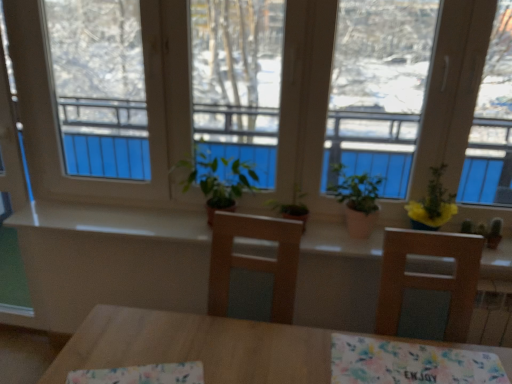
Image resolution: width=512 pixels, height=384 pixels. What do you see at coordinates (357, 200) in the screenshot? I see `green matte plant at center, the second houseplant viewed from the right` at bounding box center [357, 200].

Describe the element at coordinates (292, 207) in the screenshot. This screenshot has width=512, height=384. I see `green matte plant at center, marked as the first houseplant in a left-to-right arrangement` at that location.

The image size is (512, 384). What are the coordinates of `green matte plant at center, the third houseplant viewed from the right` in the screenshot? It's located at [292, 207].

This screenshot has width=512, height=384. In order to click on yellow matte plant at upper right, acting as the 1th houseplant starting from the right in this screenshot , I will do `click(433, 204)`.

Locate an element on the screen. This screenshot has height=384, width=512. green matte plant at center, the second houseplant viewed from the right is located at coordinates (357, 200).

In the scene shown: Is floral fabric tablecloth at lower center, which is the 1th tablecloth in right-to-left order, taller or shorter than white glossy counter top at center?

In the image, floral fabric tablecloth at lower center, which is the 1th tablecloth in right-to-left order, appears to be shorter than white glossy counter top at center.

Between floral fabric tablecloth at lower center, positioned as the 2th tablecloth in left-to-right order, and white glossy counter top at center, which one has larger size?

With larger size is white glossy counter top at center.

Considering the relative positions of floral fabric tablecloth at lower center, positioned as the 2th tablecloth in left-to-right order, and white glossy counter top at center in the image provided, is floral fabric tablecloth at lower center, positioned as the 2th tablecloth in left-to-right order, to the left of white glossy counter top at center from the viewer's perspective?

In fact, floral fabric tablecloth at lower center, positioned as the 2th tablecloth in left-to-right order, is to the right of white glossy counter top at center.

Is point (417, 370) in front of point (191, 232)?

Yes, point (417, 370) is closer to viewer.

From a real-world perspective, is yellow matte plant at upper right, which is the third houseplant in left-to-right order, positioned above or below floral fabric tablecloth at lower center, positioned as the 2th tablecloth in left-to-right order?

From a real-world perspective, yellow matte plant at upper right, which is the third houseplant in left-to-right order, is physically above floral fabric tablecloth at lower center, positioned as the 2th tablecloth in left-to-right order.

Which is correct: yellow matte plant at upper right, acting as the 1th houseplant starting from the right, is inside floral fabric tablecloth at lower center, positioned as the 2th tablecloth in left-to-right order, or outside of it?

yellow matte plant at upper right, acting as the 1th houseplant starting from the right, lies outside floral fabric tablecloth at lower center, positioned as the 2th tablecloth in left-to-right order.

Is floral fabric tablecloth at lower center, which is the 1th tablecloth in right-to-left order, at the back of yellow matte plant at upper right, which is the third houseplant in left-to-right order?

That's not correct — yellow matte plant at upper right, which is the third houseplant in left-to-right order, is not looking away from floral fabric tablecloth at lower center, which is the 1th tablecloth in right-to-left order.

Can you confirm if yellow matte plant at upper right, acting as the 1th houseplant starting from the right, is taller than floral fabric tablecloth at lower center, which is the 1th tablecloth in right-to-left order?

Indeed, yellow matte plant at upper right, acting as the 1th houseplant starting from the right, has a greater height compared to floral fabric tablecloth at lower center, which is the 1th tablecloth in right-to-left order.

Considering the relative sizes of green matte plant at center, the 2th houseplant from the left, and yellow matte plant at upper right, which is the third houseplant in left-to-right order, in the image provided, is green matte plant at center, the 2th houseplant from the left, shorter than yellow matte plant at upper right, which is the third houseplant in left-to-right order,?

Indeed, green matte plant at center, the 2th houseplant from the left, has a lesser height compared to yellow matte plant at upper right, which is the third houseplant in left-to-right order.

Can yellow matte plant at upper right, which is the third houseplant in left-to-right order, be found inside green matte plant at center, the second houseplant viewed from the right?

No.

How different are the orientations of green matte plant at center, the second houseplant viewed from the right, and yellow matte plant at upper right, acting as the 1th houseplant starting from the right, in degrees?

0.00011 degrees separate the facing orientations of green matte plant at center, the second houseplant viewed from the right, and yellow matte plant at upper right, acting as the 1th houseplant starting from the right.

From the picture: Relative to yellow matte plant at upper right, acting as the 1th houseplant starting from the right, is green matte plant at center, the 2th houseplant from the left, in front or behind?

Clearly, green matte plant at center, the 2th houseplant from the left, is behind yellow matte plant at upper right, acting as the 1th houseplant starting from the right.

Which is closer, (365, 227) or (172, 220)?

Point (365, 227) appears to be closer to the viewer than point (172, 220).

How far apart are green matte plant at center, the 2th houseplant from the left, and white glossy counter top at center?

green matte plant at center, the 2th houseplant from the left, and white glossy counter top at center are 65.92 centimeters apart from each other.

Is green matte plant at center, the second houseplant viewed from the right, bigger than white glossy counter top at center?

Incorrect, green matte plant at center, the second houseplant viewed from the right, is not larger than white glossy counter top at center.

Is point (312, 250) more distant than point (444, 370)?

Yes, it is.

Is white glossy counter top at center bigger or smaller than floral fabric tablecloth at lower center, positioned as the 2th tablecloth in left-to-right order?

In the image, white glossy counter top at center appears to be larger than floral fabric tablecloth at lower center, positioned as the 2th tablecloth in left-to-right order.

From a real-world perspective, does white glossy counter top at center stand above floral fabric tablecloth at lower center, which is the 1th tablecloth in right-to-left order?

No.

Is white glossy counter top at center looking in the opposite direction of floral fabric tablecloth at lower center, which is the 1th tablecloth in right-to-left order?

Yes, floral fabric tablecloth at lower center, which is the 1th tablecloth in right-to-left order, is at the back of white glossy counter top at center.

From a real-world perspective, is green matte plant at center, marked as the first houseplant in a left-to-right arrangement, physically located above or below white glossy counter top at center?

In terms of real-world spatial position, green matte plant at center, marked as the first houseplant in a left-to-right arrangement, is above white glossy counter top at center.

Is green matte plant at center, marked as the first houseplant in a left-to-right arrangement, to the right of white glossy counter top at center from the viewer's perspective?

Correct, you'll find green matte plant at center, marked as the first houseplant in a left-to-right arrangement, to the right of white glossy counter top at center.

Can white glossy counter top at center be found inside green matte plant at center, the third houseplant viewed from the right?

Actually, white glossy counter top at center is outside green matte plant at center, the third houseplant viewed from the right.

Is green matte plant at center, marked as the first houseplant in a left-to-right arrangement, facing towards white glossy counter top at center?

No, green matte plant at center, marked as the first houseplant in a left-to-right arrangement, is not turned towards white glossy counter top at center.

Which of these two, green matte plant at center, the second houseplant viewed from the right, or green matte plant at center, marked as the first houseplant in a left-to-right arrangement, is bigger?

With larger size is green matte plant at center, the second houseplant viewed from the right.

Is green matte plant at center, the 2th houseplant from the left, positioned before green matte plant at center, marked as the first houseplant in a left-to-right arrangement?

Yes, green matte plant at center, the 2th houseplant from the left, is closer to the viewer.

Is there a large distance between green matte plant at center, the 2th houseplant from the left, and green matte plant at center, marked as the first houseplant in a left-to-right arrangement?

They are positioned close to each other.

From a real-world perspective, which object stands above the other?

From a 3D spatial view, green matte plant at center, the 2th houseplant from the left, is above.

This screenshot has height=384, width=512. In order to click on tablecloth that appears on the right of white glossy counter top at center in this screenshot , I will do `click(409, 363)`.

Find the location of a particular element. the 3rd houseplant directly above the floral fabric tablecloth at lower center, which is the 1th tablecloth in right-to-left order (from a real-world perspective) is located at coordinates (433, 204).

Based on their spatial positions, is white glossy counter top at center or yellow matte plant at upper right, acting as the 1th houseplant starting from the right, closer to green matte plant at center, marked as the first houseplant in a left-to-right arrangement?

white glossy counter top at center is closer to green matte plant at center, marked as the first houseplant in a left-to-right arrangement.

From the image, which object appears to be farther from green matte plant at center, the 2th houseplant from the left, white glossy counter top at center or transparent glass window at center?

Among the two, white glossy counter top at center is located further to green matte plant at center, the 2th houseplant from the left.

When comparing their distances from transparent glass window at center, does floral fabric at center, which appears as the first tablecloth when viewed from the left, or floral fabric tablecloth at lower center, which is the 1th tablecloth in right-to-left order, seem further?

Based on the image, floral fabric at center, which appears as the first tablecloth when viewed from the left, appears to be further to transparent glass window at center.

Looking at the image, which one is located closer to transparent glass window at center, white glossy counter top at center or yellow matte plant at upper right, acting as the 1th houseplant starting from the right?

Among the two, white glossy counter top at center is located nearer to transparent glass window at center.

Considering their positions, is floral fabric at center, which appears as the first tablecloth when viewed from the left, positioned closer to transparent glass window at center than white glossy counter top at center?

white glossy counter top at center.

Considering their positions, is white glossy counter top at center positioned further to yellow matte plant at upper right, acting as the 1th houseplant starting from the right, than floral fabric at center, which appears as the first tablecloth when viewed from the left?

floral fabric at center, which appears as the first tablecloth when viewed from the left.

When comparing their distances from white glossy counter top at center, does floral fabric tablecloth at lower center, positioned as the 2th tablecloth in left-to-right order, or green matte plant at center, the third houseplant viewed from the right, seem closer?

green matte plant at center, the third houseplant viewed from the right, lies closer to white glossy counter top at center than the other object.

Looking at this image, considering their positions, is floral fabric tablecloth at lower center, positioned as the 2th tablecloth in left-to-right order, positioned closer to green matte plant at center, marked as the first houseplant in a left-to-right arrangement, than transparent glass window at center?

transparent glass window at center is positioned closer to the anchor green matte plant at center, marked as the first houseplant in a left-to-right arrangement.

The image size is (512, 384). I want to click on counter top between transparent glass window at center and floral fabric tablecloth at lower center, which is the 1th tablecloth in right-to-left order, from top to bottom, so click(x=113, y=221).

Locate an element on the screen. This screenshot has width=512, height=384. window between floral fabric tablecloth at lower center, positioned as the 2th tablecloth in left-to-right order, and green matte plant at center, the third houseplant viewed from the right, in the front-back direction is located at coordinates (435, 105).

This screenshot has width=512, height=384. I want to click on houseplant between white glossy counter top at center and green matte plant at center, the 2th houseplant from the left, from left to right, so click(292, 207).

Find the location of a particular element. The image size is (512, 384). tablecloth between floral fabric at center, the second tablecloth from the right, and yellow matte plant at upper right, acting as the 1th houseplant starting from the right, from left to right is located at coordinates (409, 363).